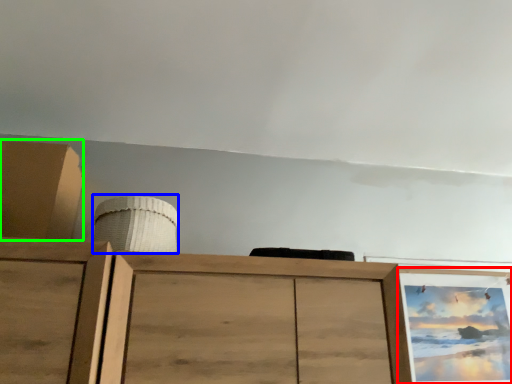
Question: Which object is the farthest from picture frame (highlighted by a red box)? Choose among these: job (highlighted by a blue box) or cabinetry (highlighted by a green box).

Choices:
 (A) job
 (B) cabinetry

Answer: (B)